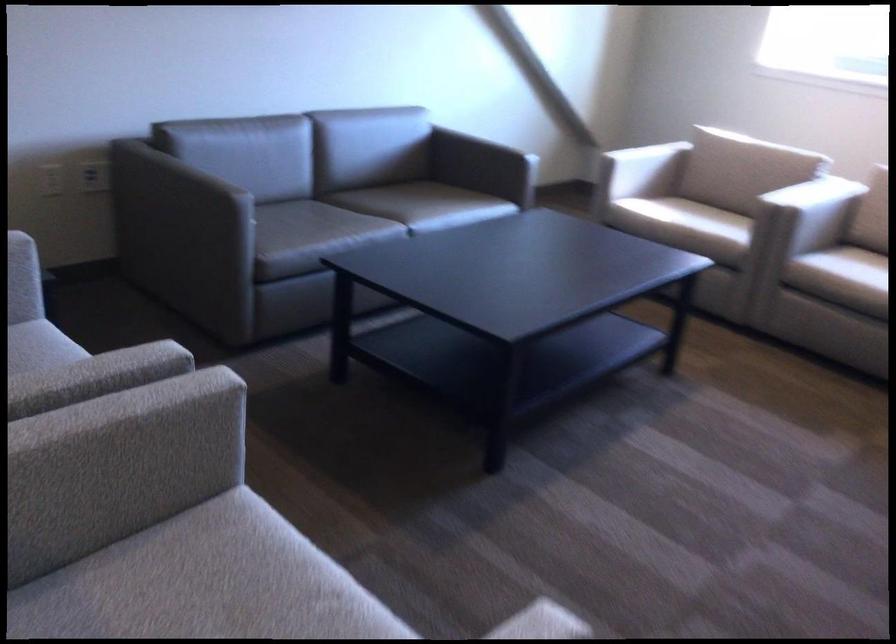
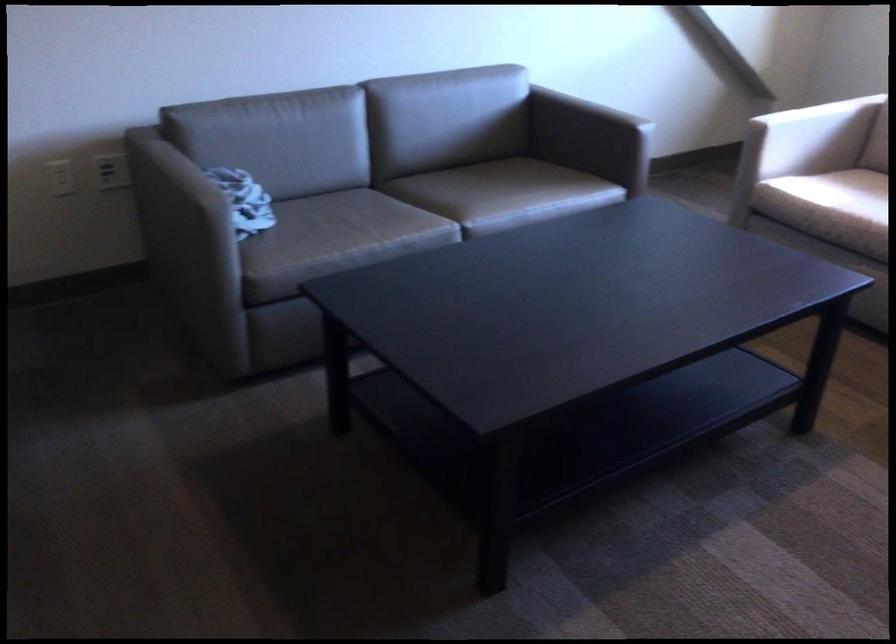
Question: The images are taken continuously from a first-person perspective. In which direction is your viewpoint rotating?

Choices:
 (A) Left
 (B) Right
 (C) Up
 (D) Down

Answer: (A)